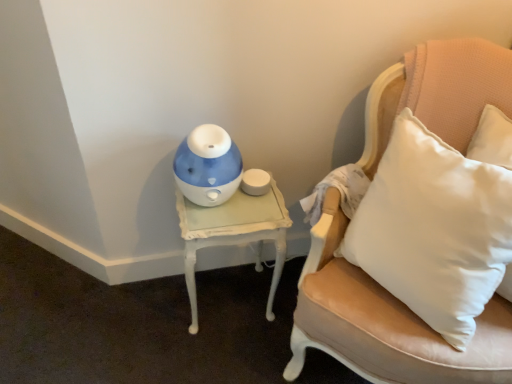
Find the location of a particular element. The image size is (512, 384). vacant space underneath white painted wood table at left (from a real-world perspective) is located at coordinates (226, 296).